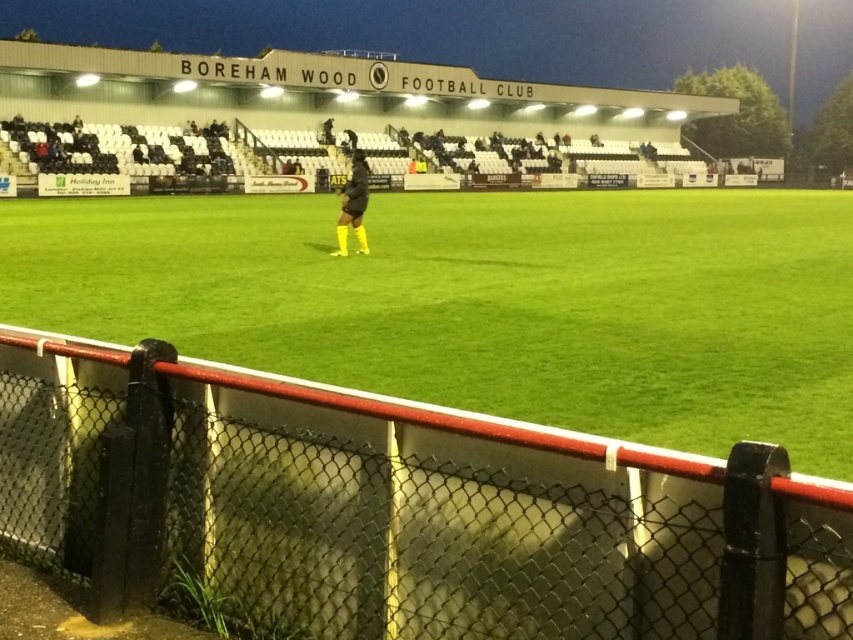
You are standing at the point labeled point [233,589] and want to walk towards the point labeled point [352,192]. Which direction should you move to get closer to your destination?

To move from point [233,589] towards point [352,192], you should move towards the direction away from the camera since point [352,192] is farther from the camera compared to your current position at point [233,589].